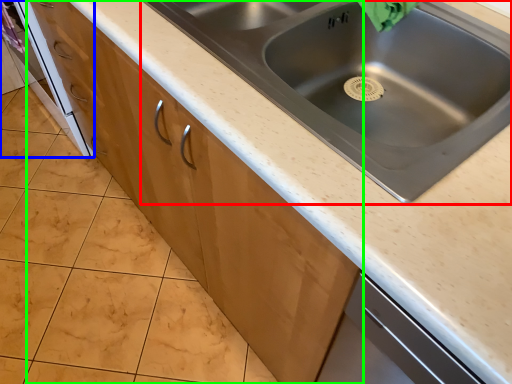
Question: Considering the real-world distances, which object is closest to sink (highlighted by a red box)? oven (highlighted by a blue box) or cabinetry (highlighted by a green box).

Choices:
 (A) oven
 (B) cabinetry

Answer: (B)